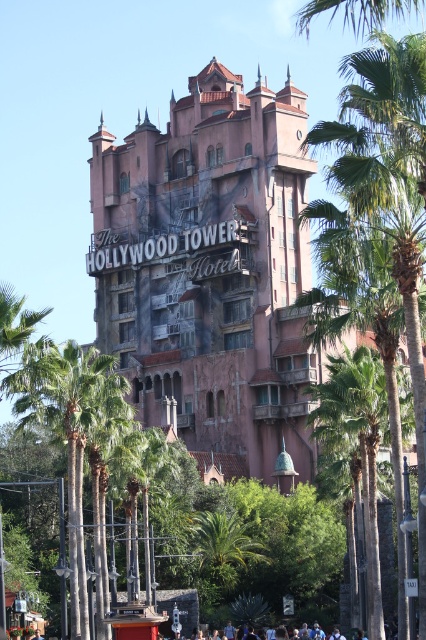
Does pink textured building at center appear on the left side of green leafy palm tree at center?

Yes, pink textured building at center is to the left of green leafy palm tree at center.

Which is behind, point (273, 454) or point (322, 416)?

Positioned behind is point (273, 454).

Locate an element on the screen. This screenshot has width=426, height=640. pink textured building at center is located at coordinates (210, 269).

Does green leafy palm tree at center appear on the right side of light blue shirt at lower center?

Indeed, green leafy palm tree at center is positioned on the right side of light blue shirt at lower center.

Is green leafy palm tree at center bigger than light blue shirt at lower center?

Yes, green leafy palm tree at center is bigger than light blue shirt at lower center.

Identify the location of green leafy palm tree at center. Image resolution: width=426 pixels, height=640 pixels. coord(362,444).

Identify the location of green leafy palm tree at center. (362, 444).

How distant is pink textured building at center from light blue shirt at lower center?

pink textured building at center and light blue shirt at lower center are 34.52 meters apart from each other.

Which is behind, point (276, 93) or point (356, 637)?

Positioned behind is point (276, 93).

Where is `pink textured building at center`? Image resolution: width=426 pixels, height=640 pixels. pink textured building at center is located at coordinates (210, 269).